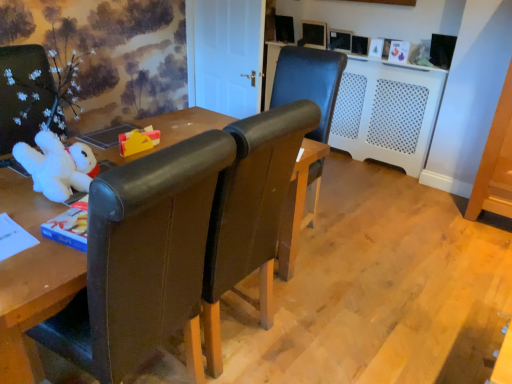
Question: Are leather chair at left, the second chair from the back, and leather chair at center, which ranks as the 2th chair in left-to-right order, making contact?

Choices:
 (A) no
 (B) yes

Answer: (A)

Question: Is leather chair at left, the second chair from the back, further to the viewer compared to leather chair at center, the first chair when ordered from back to front?

Choices:
 (A) yes
 (B) no

Answer: (B)

Question: Considering the relative positions of leather chair at left, positioned as the 1th chair in front-to-back order, and leather chair at center, the first chair when ordered from back to front, in the image provided, is leather chair at left, positioned as the 1th chair in front-to-back order, to the left of leather chair at center, the first chair when ordered from back to front, from the viewer's perspective?

Choices:
 (A) yes
 (B) no

Answer: (A)

Question: Is leather chair at left, the second chair from the back, far away from leather chair at center, placed as the first chair when sorted from right to left?

Choices:
 (A) no
 (B) yes

Answer: (B)

Question: From a real-world perspective, is leather chair at left, positioned as the 1th chair in front-to-back order, located higher than leather chair at center, which ranks as the 2th chair in left-to-right order?

Choices:
 (A) yes
 (B) no

Answer: (A)

Question: Looking at their shapes, would you say white plastic radiator at center is wider or thinner than matte yellow toy at center, placed as the 2th toy when sorted from front to back?

Choices:
 (A) wide
 (B) thin

Answer: (A)

Question: Based on their positions, is white plastic radiator at center located to the left or right of matte yellow toy at center, placed as the 2th toy when sorted from front to back?

Choices:
 (A) left
 (B) right

Answer: (B)

Question: From a real-world perspective, is white plastic radiator at center physically located above or below matte yellow toy at center, placed as the 2th toy when sorted from front to back?

Choices:
 (A) above
 (B) below

Answer: (B)

Question: Is white plastic radiator at center inside or outside of matte yellow toy at center, placed as the 2th toy when sorted from front to back?

Choices:
 (A) outside
 (B) inside

Answer: (A)

Question: Is leather chair at center, the first chair when ordered from back to front, taller or shorter than leather chair at left, positioned as the 1th chair in left-to-right order?

Choices:
 (A) tall
 (B) short

Answer: (B)

Question: In terms of size, does leather chair at center, placed as the first chair when sorted from right to left, appear bigger or smaller than leather chair at left, which is the second chair from right to left?

Choices:
 (A) small
 (B) big

Answer: (A)

Question: Is point (311, 132) closer or farther from the camera than point (189, 281)?

Choices:
 (A) closer
 (B) farther

Answer: (B)

Question: From a real-world perspective, is leather chair at center, placed as the first chair when sorted from right to left, positioned above or below leather chair at left, which is the second chair from right to left?

Choices:
 (A) below
 (B) above

Answer: (A)

Question: Would you say white plush toy at left, which is the second toy in back-to-front order, is to the left or to the right of matte yellow toy at center, arranged as the first toy when viewed from the back, in the picture?

Choices:
 (A) left
 (B) right

Answer: (A)

Question: Relative to matte yellow toy at center, placed as the 2th toy when sorted from front to back, is white plush toy at left, which is the second toy in back-to-front order, in front or behind?

Choices:
 (A) front
 (B) behind

Answer: (A)